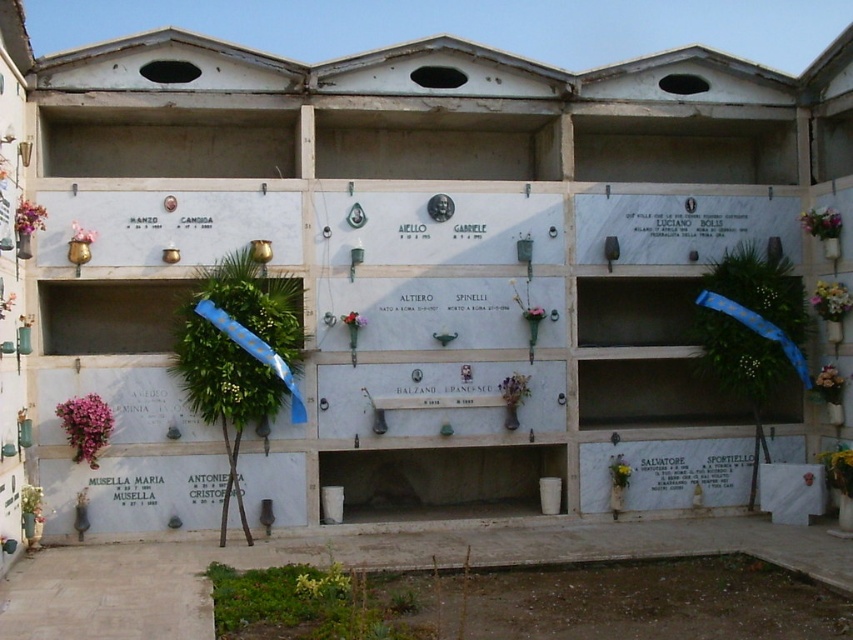
You are standing in front of the crypts and want to place a new floral arrangement between the green leafy wreath at center and the white matte flowers at center right. Based on their positions, which one should you move to make space?

The green leafy wreath at center is closer to the viewer than the white matte flowers at center right, so you should move the green leafy wreath at center to create space between them.

You are a florist arranging flowers for a client who wants to place a new decoration between the green leafy wreath at center and the pink fabric flower at upper right. The client wants the new decoration to be exactly halfway between them. Can you determine if the space between the two decorations is wide enough to fit a new decoration that is 10 cm in width?

The green leafy wreath at center might be wider than pink fabric flower at upper right, but without knowing the exact distance between them, it is impossible to determine if the space is wide enough for a 10 cm decoration.